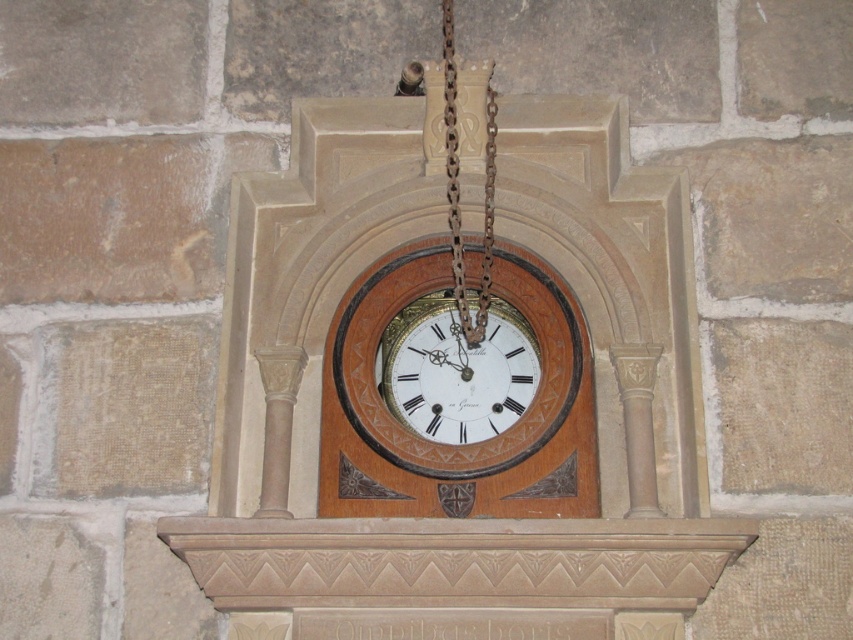
Consider the image. Is gold metallic clock at center behind wooden clock at center?

Yes.

Is gold metallic clock at center wider than wooden clock at center?

Incorrect, gold metallic clock at center's width does not surpass wooden clock at center's.

The image size is (853, 640). In order to click on gold metallic clock at center in this screenshot , I will do `click(456, 371)`.

Which is more to the right, gold metallic clock at center or rusty metal chain at center?

From the viewer's perspective, gold metallic clock at center appears more on the right side.

Is point (397, 380) more distant than point (456, 93)?

No.

You are a GUI agent. You are given a task and a screenshot of the screen. Output one action in this format:
    pyautogui.click(x=<x>, y=<y>)
    Task: Click on the gold metallic clock at center
    
    Given the screenshot: What is the action you would take?
    pyautogui.click(x=456, y=371)

Which is behind, point (467, 307) or point (491, 253)?

Point (467, 307)

Locate an element on the screen. wooden clock at center is located at coordinates (494, 435).